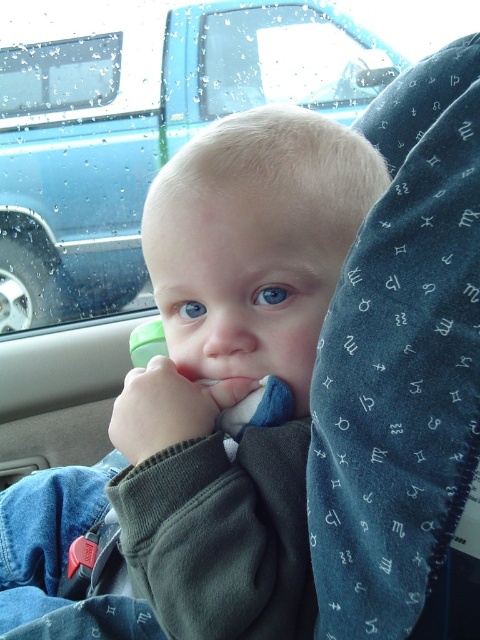
You are a passenger in the car and want to show your friend the blue fabric car at upper center and the transparent glass window at upper center outside. Which one do you think is bigger in size?

The blue fabric car at upper center is larger in size than the transparent glass window at upper center, so the blue fabric car at upper center is bigger.

You are a parent checking if your child has a drink available. The child is sitting in a car seat with a harness. Do you think the smooth green sippy cup at center can fit through the transparent glass window at upper left if it were to fall?

The smooth green sippy cup at center is thinner than the transparent glass window at upper left, so it could potentially fit through if it were to fall.

You are a passenger in the car and want to show your friend the blue fabric car at upper center and the transparent glass window at upper center outside. Which one of these two objects is wider?

The blue fabric car at upper center is wider than the transparent glass window at upper center according to the description.